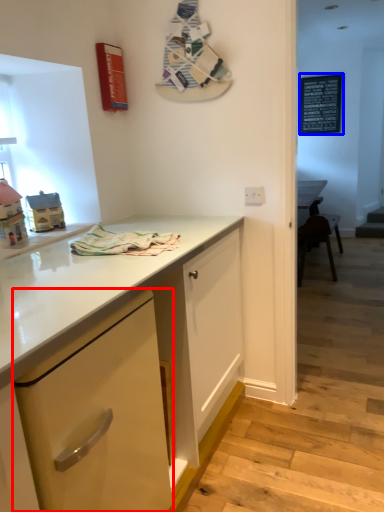
Question: Which object appears farthest to the camera in this image, cabinetry (highlighted by a red box) or bulletin board (highlighted by a blue box)?

Choices:
 (A) cabinetry
 (B) bulletin board

Answer: (B)